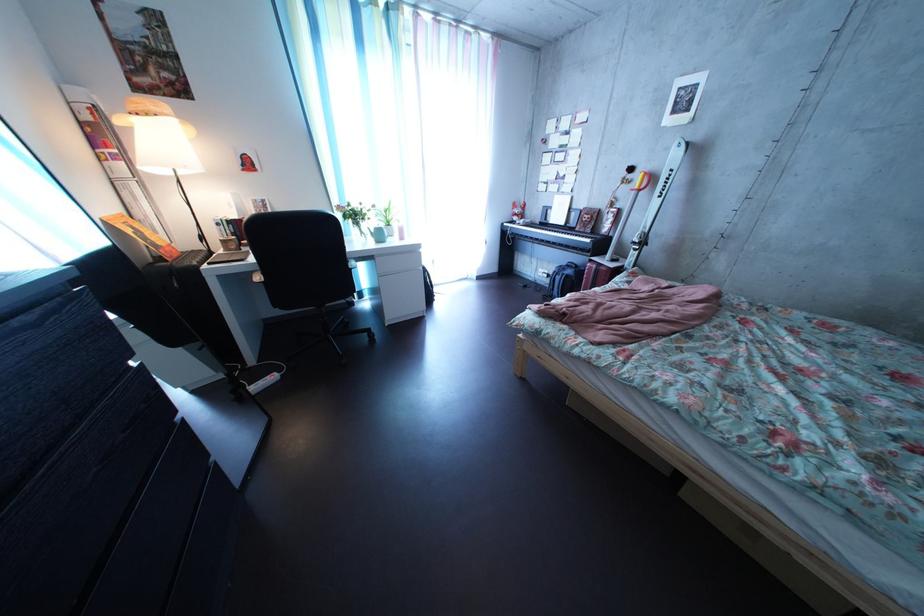
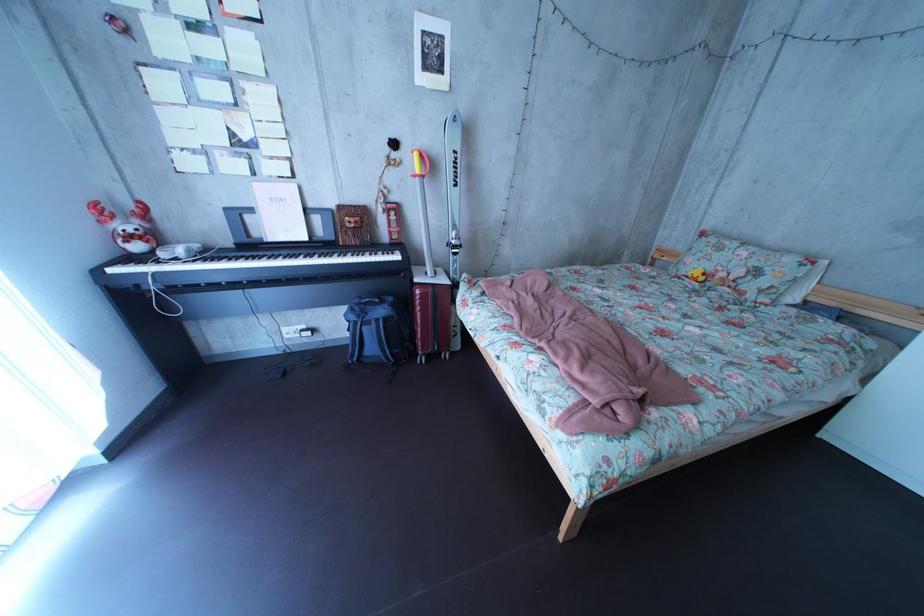
The point at (x=584, y=280) is marked in the first image. Where is the corresponding point in the second image?

(395, 320)